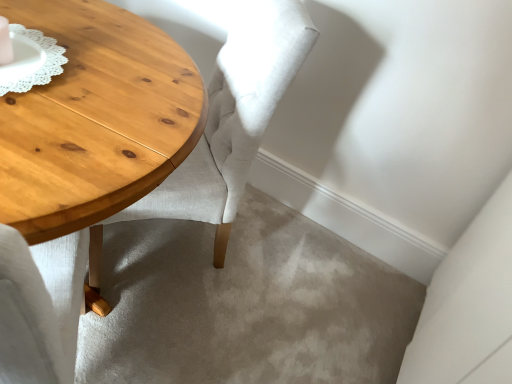
This screenshot has width=512, height=384. Find the location of `light gray fabric chair at center`. light gray fabric chair at center is located at coordinates coord(228,124).

This screenshot has height=384, width=512. Describe the element at coordinates (228, 124) in the screenshot. I see `light gray fabric chair at center` at that location.

I want to click on light gray fabric chair at center, so click(228, 124).